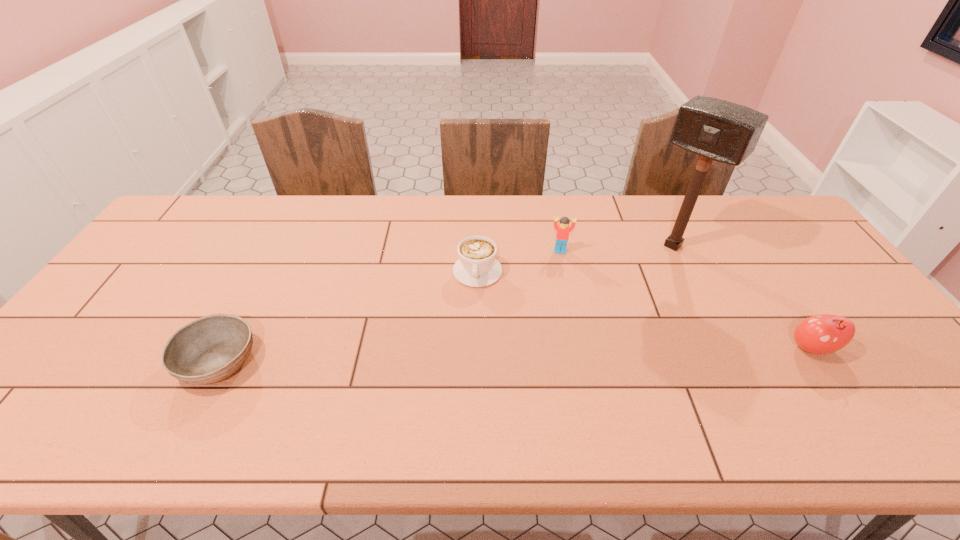
You are a GUI agent. You are given a task and a screenshot of the screen. Output one action in this format:
    pyautogui.click(x=<x>, y=<y>)
    Task: Click on the free space that satisfies the following two spatial constraints: 1. on the back side of the fourth tallest object; 2. on the left side of the third object from right to left
    The height and width of the screenshot is (540, 960).
    Given the screenshot: What is the action you would take?
    pyautogui.click(x=478, y=251)

Locate an element on the screen. This screenshot has height=540, width=960. free space that satisfies the following two spatial constraints: 1. on the back side of the Lego; 2. on the left side of the cappuccino is located at coordinates (478, 251).